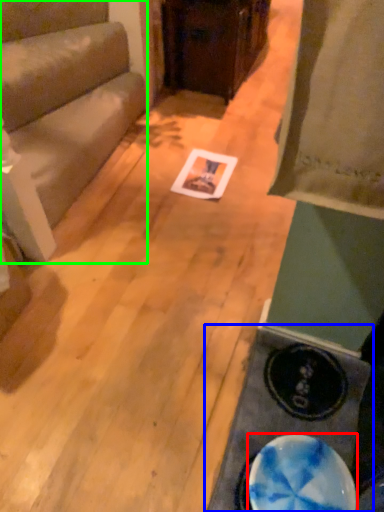
Question: Estimate the real-world distances between objects in this image. Which object is farther from plate (highlighted by a red box), table (highlighted by a blue box) or furniture (highlighted by a green box)?

Choices:
 (A) table
 (B) furniture

Answer: (B)